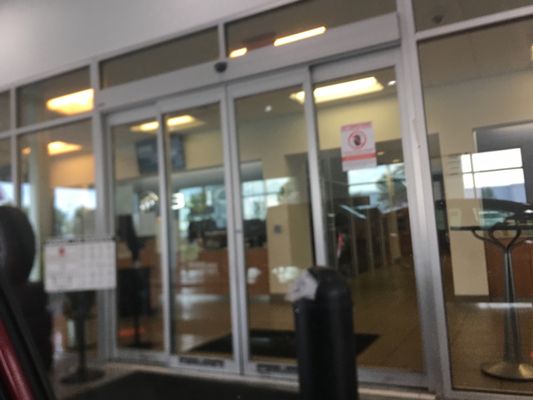
Locate an element on the screen. The height and width of the screenshot is (400, 533). doorway is located at coordinates (439, 143).